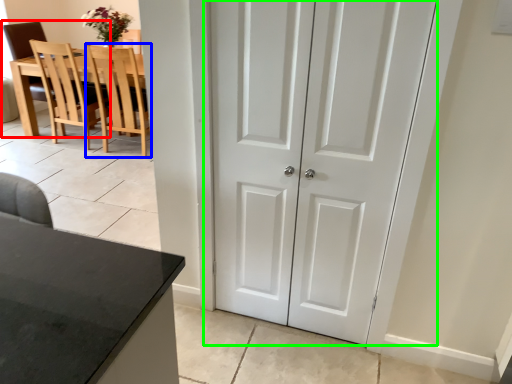
Question: Considering the real-world distances, which object is closest to chair (highlighted by a red box)? chair (highlighted by a blue box) or door (highlighted by a green box).

Choices:
 (A) chair
 (B) door

Answer: (A)